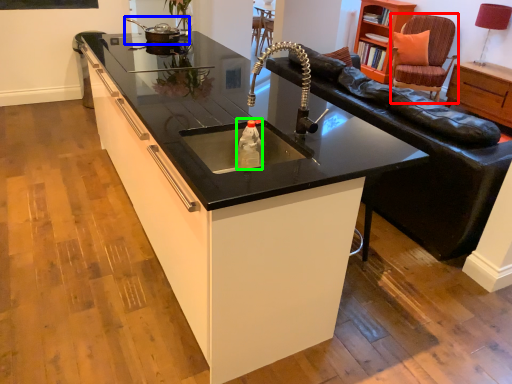
Question: Considering the real-world distances, which object is farthest from swivel chair (highlighted by a red box)? appliance (highlighted by a blue box) or bottle (highlighted by a green box)?

Choices:
 (A) appliance
 (B) bottle

Answer: (B)